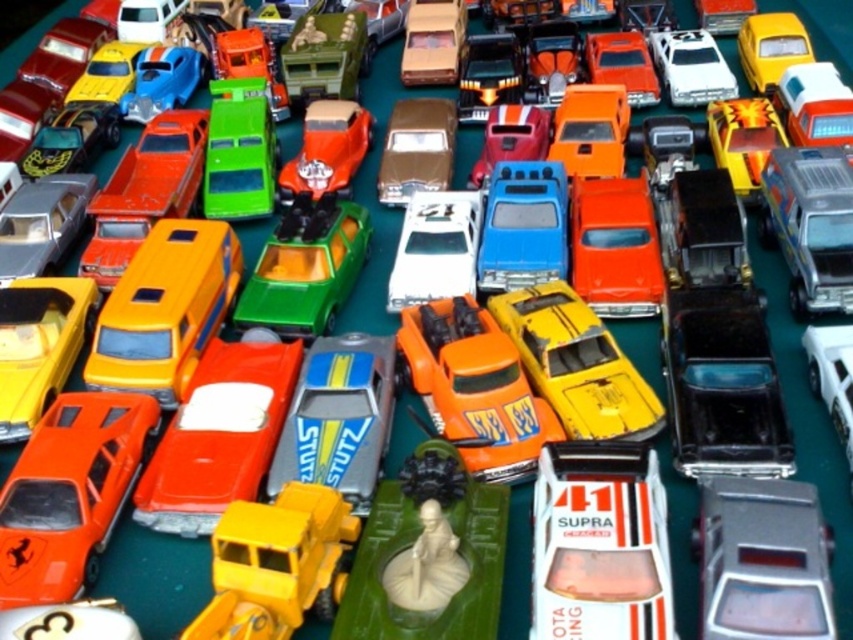
Who is positioned more to the right, metallic yellow truck at center-left or green plastic truck at upper center?

From the viewer's perspective, metallic yellow truck at center-left appears more on the right side.

Is point (303, 556) closer to camera compared to point (209, 198)?

Yes, point (303, 556) is closer to viewer.

Which is in front, point (223, 612) or point (265, 168)?

Point (223, 612) is in front.

This screenshot has width=853, height=640. What are the coordinates of `metallic yellow truck at center-left` in the screenshot? It's located at (276, 563).

Does metallic silver truck at right appear under yellow matte car at upper right?

Yes.

You are a GUI agent. You are given a task and a screenshot of the screen. Output one action in this format:
    pyautogui.click(x=<x>, y=<y>)
    Task: Click on the metallic silver truck at right
    The image size is (853, 640).
    Given the screenshot: What is the action you would take?
    pyautogui.click(x=810, y=225)

Is point (621, 486) positioned in front of point (62, 464)?

Yes, it is in front of point (62, 464).

Can you confirm if white glossy supra at center is wider than orange matte supra at lower left?

Correct, the width of white glossy supra at center exceeds that of orange matte supra at lower left.

Which is in front, point (614, 570) or point (71, 556)?

Positioned in front is point (614, 570).

Locate an element on the screen. white glossy supra at center is located at coordinates (599, 545).